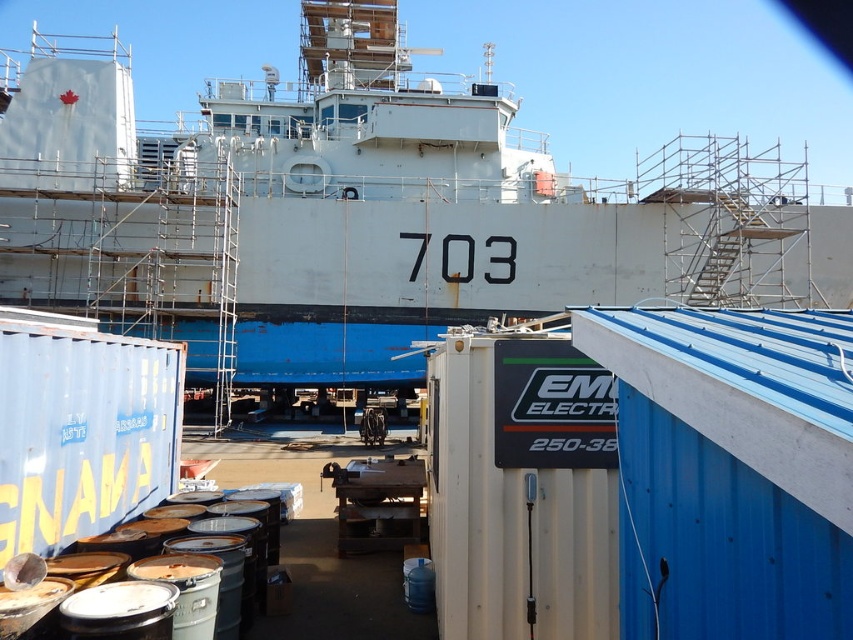
Question: Which of the following is the closest to the observer?

Choices:
 (A) (161, 477)
 (B) (395, 458)

Answer: (A)

Question: Which object appears closest to the camera in this image?

Choices:
 (A) white matte ship at center
 (B) metallic dock at center
 (C) blue matte shipping container at lower left

Answer: (C)

Question: Which point is farther to the camera?

Choices:
 (A) blue matte shipping container at lower left
 (B) metallic dock at center

Answer: (B)

Question: Is white matte ship at center to the right of blue matte shipping container at lower left from the viewer's perspective?

Choices:
 (A) yes
 (B) no

Answer: (B)

Question: Is white matte ship at center positioned before metallic dock at center?

Choices:
 (A) yes
 (B) no

Answer: (B)

Question: Can you confirm if white matte ship at center is wider than blue matte shipping container at lower left?

Choices:
 (A) yes
 (B) no

Answer: (A)